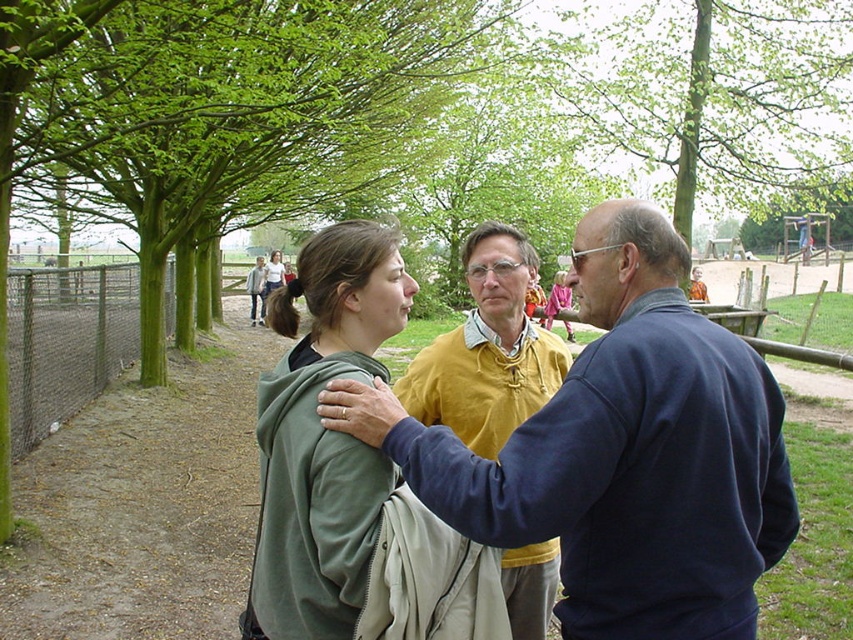
What are the coordinates of the blue fleece jacket at center?

The blue fleece jacket at center is located at coordinates point [621,452].

You are a park visitor trying to decide which jacket to borrow from your friends. You see the blue fleece jacket at center and the green matte jacket at center. Which jacket is smaller in size?

The blue fleece jacket at center is smaller in size compared to the green matte jacket at center.